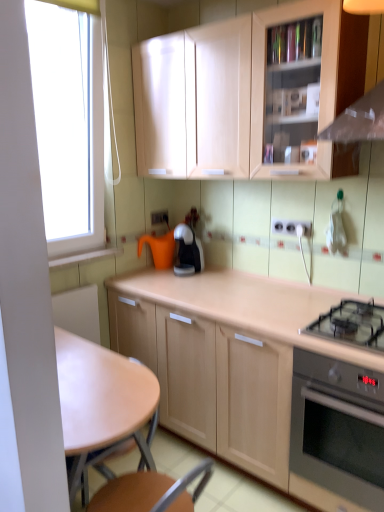
Question: Can you confirm if light brown wooden table at center is wider than black glass gas stove at lower right?

Choices:
 (A) yes
 (B) no

Answer: (B)

Question: Is light brown wooden table at center in contact with black glass gas stove at lower right?

Choices:
 (A) yes
 (B) no

Answer: (B)

Question: Is light brown wooden table at center outside black glass gas stove at lower right?

Choices:
 (A) yes
 (B) no

Answer: (A)

Question: Is light brown wooden table at center oriented away from black glass gas stove at lower right?

Choices:
 (A) no
 (B) yes

Answer: (B)

Question: From the image's perspective, does light brown wooden table at center appear lower than black glass gas stove at lower right?

Choices:
 (A) yes
 (B) no

Answer: (A)

Question: In the image, is matte wood cabinet at upper center, placed as the 2th cabinetry when sorted from bottom to top, on the left side or the right side of white plastic electrical outlet at center, which appears as the 1th electric outlet when viewed from the right?

Choices:
 (A) left
 (B) right

Answer: (A)

Question: Considering the positions of matte wood cabinet at upper center, placed as the 2th cabinetry when sorted from bottom to top, and white plastic electrical outlet at center, the 2th electric outlet viewed from the left, in the image, is matte wood cabinet at upper center, placed as the 2th cabinetry when sorted from bottom to top, taller or shorter than white plastic electrical outlet at center, the 2th electric outlet viewed from the left,?

Choices:
 (A) short
 (B) tall

Answer: (B)

Question: Is point (152, 139) closer or farther from the camera than point (279, 231)?

Choices:
 (A) closer
 (B) farther

Answer: (B)

Question: In terms of size, does matte wood cabinet at upper center, placed as the 2th cabinetry when sorted from bottom to top, appear bigger or smaller than white plastic electrical outlet at center, marked as the second electric outlet in a back-to-front arrangement?

Choices:
 (A) big
 (B) small

Answer: (A)

Question: Considering their positions, is white plastic electrical outlet at center, which is counted as the first electric outlet, starting from the front, located in front of or behind white plastic electric outlet at center, which ranks as the first electric outlet in left-to-right order?

Choices:
 (A) front
 (B) behind

Answer: (A)

Question: Is white plastic electrical outlet at center, the 2th electric outlet viewed from the top, bigger or smaller than white plastic electric outlet at center, the 2th electric outlet in the bottom-to-top sequence?

Choices:
 (A) small
 (B) big

Answer: (B)

Question: From a real-world perspective, is white plastic electrical outlet at center, the 2th electric outlet viewed from the top, above or below white plastic electric outlet at center, which is the 1th electric outlet from top to bottom?

Choices:
 (A) below
 (B) above

Answer: (B)

Question: Would you say white plastic electrical outlet at center, the 2th electric outlet viewed from the left, is to the left or to the right of white plastic electric outlet at center, placed as the 2th electric outlet when sorted from right to left, in the picture?

Choices:
 (A) left
 (B) right

Answer: (B)

Question: Is light brown wooden table at center bigger or smaller than matte wood cabinet at upper center, placed as the 1th cabinetry when sorted from top to bottom?

Choices:
 (A) big
 (B) small

Answer: (A)

Question: Do you think light brown wooden table at center is within matte wood cabinet at upper center, placed as the 1th cabinetry when sorted from top to bottom, or outside of it?

Choices:
 (A) inside
 (B) outside

Answer: (B)